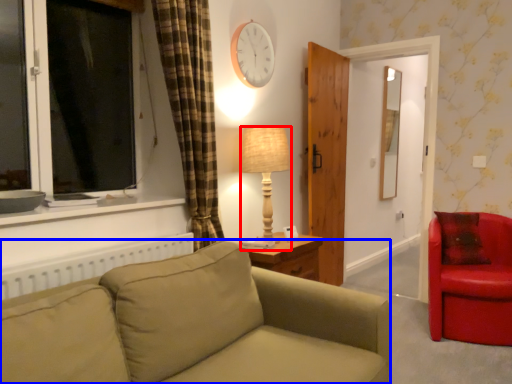
Question: Which object is closer to the camera taking this photo, lamp (highlighted by a red box) or studio couch (highlighted by a blue box)?

Choices:
 (A) lamp
 (B) studio couch

Answer: (B)